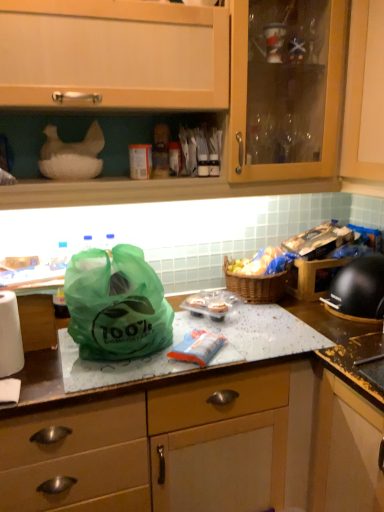
Question: From a real-world perspective, relative to wooden cabinet at upper center, is woven brown picnic basket at center vertically above or below?

Choices:
 (A) below
 (B) above

Answer: (A)

Question: Is woven brown picnic basket at center in front of or behind wooden cabinet at upper center in the image?

Choices:
 (A) front
 (B) behind

Answer: (B)

Question: Which object is the closest to the white paper towel at left?

Choices:
 (A) black plastic helmet at right
 (B) green plastic bag at center
 (C) woven brown picnic basket at center
 (D) brown woven basket at upper right
 (E) transparent glass countertop at center

Answer: (B)

Question: Which object is the closest to the wooden cabinet at upper center?

Choices:
 (A) green plastic bag at center
 (B) white paper towel at left
 (C) transparent glass countertop at center
 (D) black plastic helmet at right
 (E) woven brown picnic basket at center

Answer: (A)